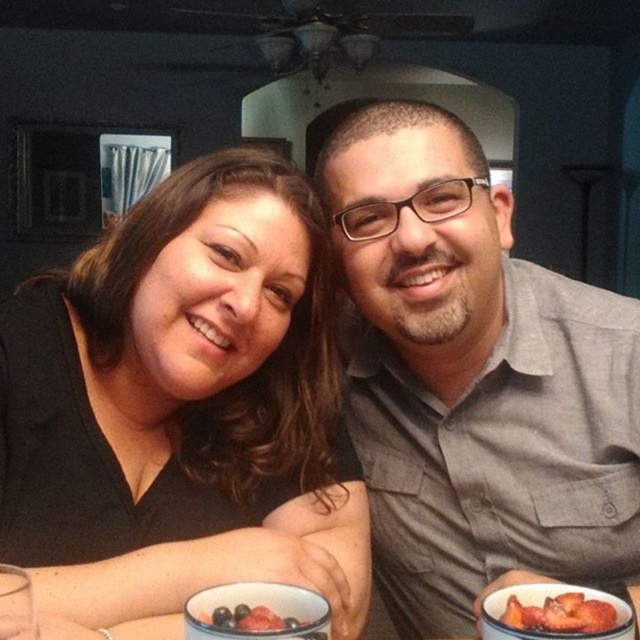
You are a photographer taking a picture of the scene. You want to ensure both the gray cotton shirt at center and the smooth red strawberries at lower right are clearly visible. Which object should you focus on first if you want to capture the larger one in sharp detail?

The gray cotton shirt at center has a larger size compared to the smooth red strawberries at lower right, so you should focus on the gray cotton shirt at center first to capture its details clearly.

What is located at the coordinates point (474, 378) in the image?

The gray cotton shirt at center is located at point (474, 378).